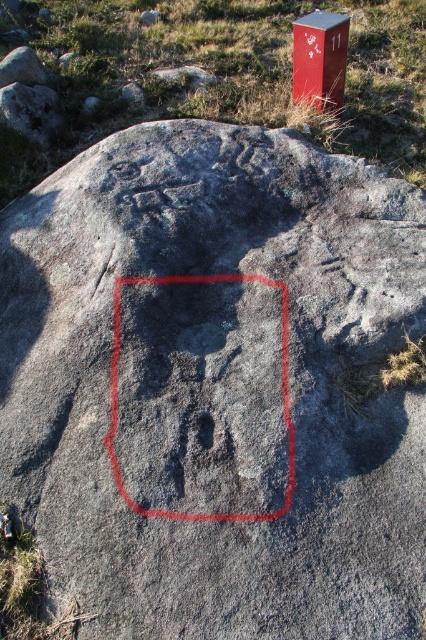
Who is more distant from viewer, (112,387) or (324,48)?

The point (324,48) is behind.

Can you confirm if gray stone carving at center is bigger than metallic red mailbox at upper right?

Correct, gray stone carving at center is larger in size than metallic red mailbox at upper right.

Image resolution: width=426 pixels, height=640 pixels. I want to click on gray stone carving at center, so click(118, 394).